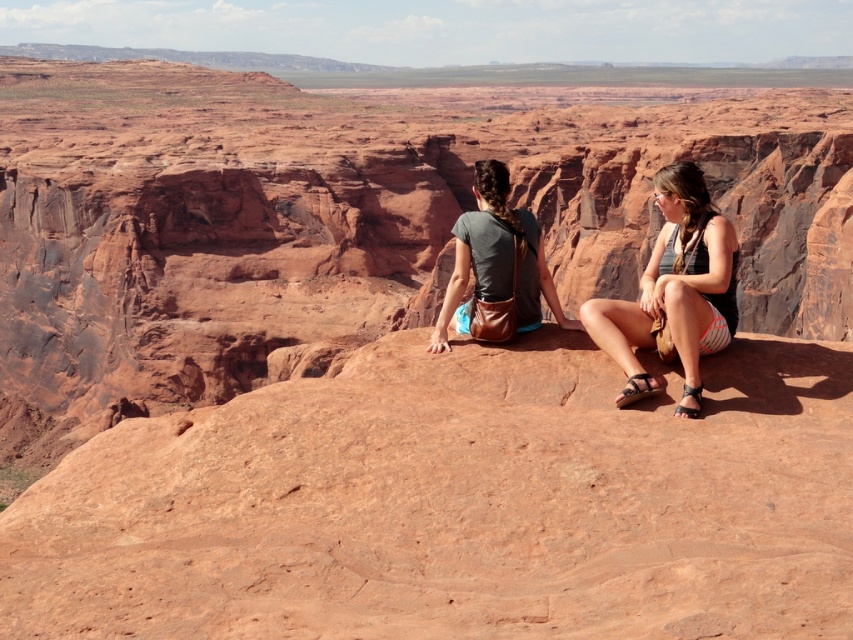
You are standing at the edge of the canyon and want to reach the point marked at coordinates point (704, 278). Given that the canyon is 100 feet wide, can you safely walk straight to that point without crossing the canyon?

The point marked at coordinates point (704, 278) is 110.95 feet away from you. Since the canyon is only 100 feet wide, the distance to the point exceeds the canyon width, so you cannot safely walk straight to that point without crossing the canyon.